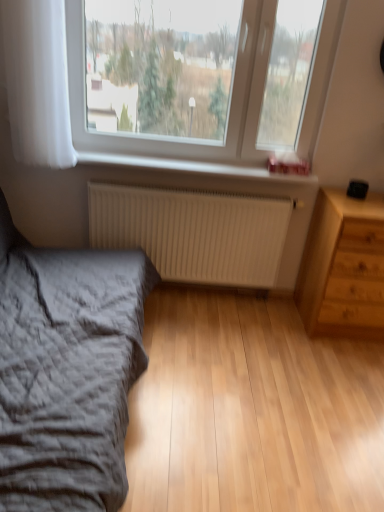
Question: Is white matte radiator at lower center to the right of transparent glass window at upper center from the viewer's perspective?

Choices:
 (A) yes
 (B) no

Answer: (B)

Question: From a real-world perspective, is white matte radiator at lower center beneath transparent glass window at upper center?

Choices:
 (A) yes
 (B) no

Answer: (A)

Question: Considering the relative sizes of white matte radiator at lower center and transparent glass window at upper center in the image provided, is white matte radiator at lower center wider than transparent glass window at upper center?

Choices:
 (A) yes
 (B) no

Answer: (B)

Question: Is white matte radiator at lower center closer to the viewer compared to transparent glass window at upper center?

Choices:
 (A) no
 (B) yes

Answer: (A)

Question: Is white matte radiator at lower center not inside transparent glass window at upper center?

Choices:
 (A) yes
 (B) no

Answer: (A)

Question: Do you think white sheer curtain at left is within white plastic radiator at lower center, or outside of it?

Choices:
 (A) inside
 (B) outside

Answer: (B)

Question: From the image's perspective, is white sheer curtain at left located above or below white plastic radiator at lower center?

Choices:
 (A) below
 (B) above

Answer: (B)

Question: Visually, is white sheer curtain at left positioned to the left or to the right of white plastic radiator at lower center?

Choices:
 (A) left
 (B) right

Answer: (A)

Question: Is white sheer curtain at left wider or thinner than white plastic radiator at lower center?

Choices:
 (A) thin
 (B) wide

Answer: (B)

Question: Visually, is white plastic radiator at lower center positioned to the left or to the right of white sheer curtain at left?

Choices:
 (A) left
 (B) right

Answer: (B)

Question: From the image's perspective, is white plastic radiator at lower center positioned above or below white sheer curtain at left?

Choices:
 (A) above
 (B) below

Answer: (B)

Question: In terms of width, does white plastic radiator at lower center look wider or thinner when compared to white sheer curtain at left?

Choices:
 (A) wide
 (B) thin

Answer: (B)

Question: Is point (185, 159) positioned closer to the camera than point (43, 146)?

Choices:
 (A) closer
 (B) farther

Answer: (B)

Question: From a real-world perspective, is white matte radiator at lower center positioned above or below white plastic radiator at lower center?

Choices:
 (A) above
 (B) below

Answer: (B)

Question: Relative to white plastic radiator at lower center, is white matte radiator at lower center in front or behind?

Choices:
 (A) front
 (B) behind

Answer: (B)